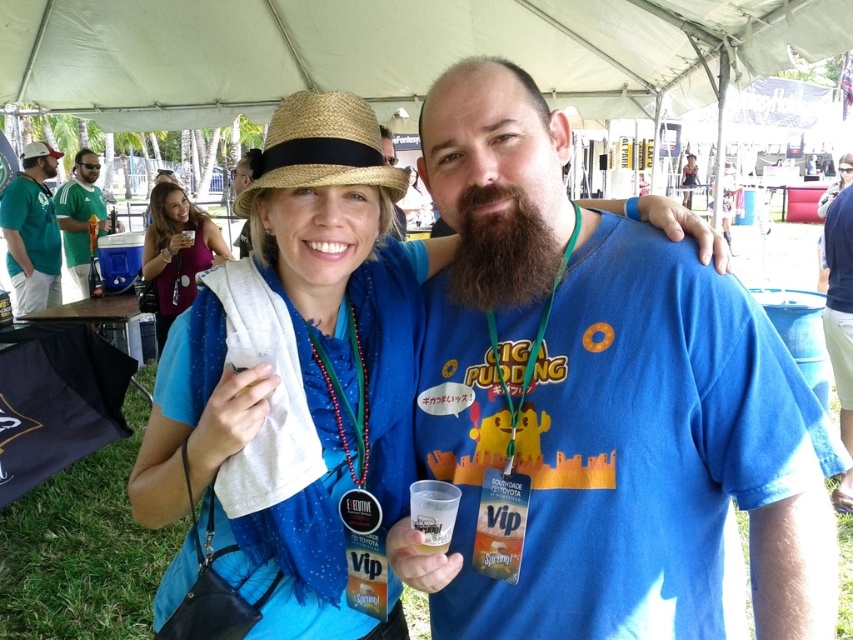
Question: Which point appears closest to the camera in this image?

Choices:
 (A) (442, 396)
 (B) (144, 252)
 (C) (28, 148)
 (D) (48, 170)

Answer: (A)

Question: Does blue fabric dress at center have a greater width compared to matte purple dress at upper left?

Choices:
 (A) yes
 (B) no

Answer: (B)

Question: Can you confirm if dark brown thick beard at center is positioned below green jersey at left?

Choices:
 (A) yes
 (B) no

Answer: (A)

Question: Which point is closer to the camera?

Choices:
 (A) green jersey at left
 (B) dark brown thick beard at center
 (C) green fabric shirt at left
 (D) straw hat at center

Answer: (B)

Question: Which of the following is the farthest from the observer?

Choices:
 (A) matte purple dress at upper left
 (B) matte black tank top at upper center
 (C) blue fabric dress at center
 (D) straw hat at center

Answer: (B)

Question: Does blue cotton shirt at center appear under straw hat at upper left?

Choices:
 (A) yes
 (B) no

Answer: (A)